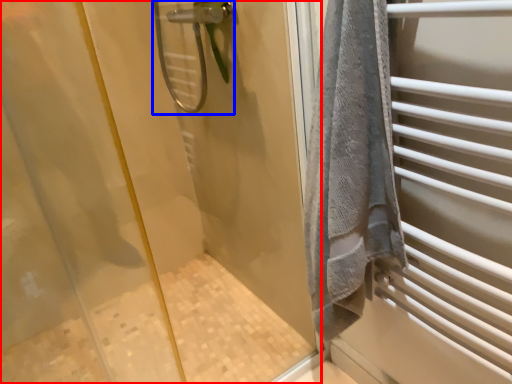
Question: Which of the following is the closest to the observer, screen door (highlighted by a red box) or shower (highlighted by a blue box)?

Choices:
 (A) screen door
 (B) shower

Answer: (A)